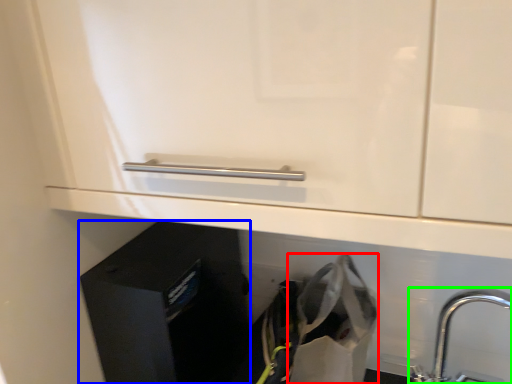
Question: Estimate the real-world distances between objects in this image. Which object is closer to shopping bag (highlighted by a red box), file cabinet (highlighted by a blue box) or tap (highlighted by a green box)?

Choices:
 (A) file cabinet
 (B) tap

Answer: (B)